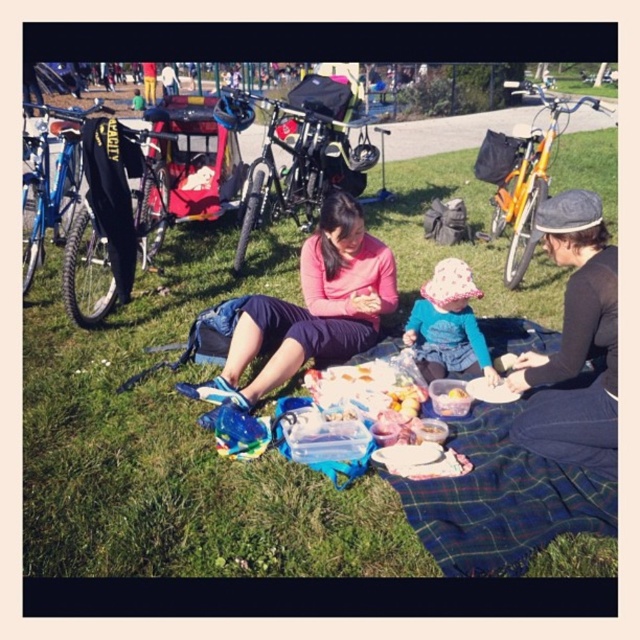
Question: Among these objects, which one is farthest from the camera?

Choices:
 (A) fluffy pink hat at center
 (B) brushed metal bicycle at center

Answer: (B)

Question: From the image, what is the correct spatial relationship of dark gray knit hat at lower right in relation to pink matte sweater at center?

Choices:
 (A) right
 (B) left

Answer: (A)

Question: Which object appears closest to the camera in this image?

Choices:
 (A) brushed metal bicycle at center
 (B) green grass at center
 (C) dark gray knit hat at lower right
 (D) smooth plastic container at center

Answer: (B)

Question: Is green grass at center to the right of smooth plastic container at center from the viewer's perspective?

Choices:
 (A) yes
 (B) no

Answer: (A)

Question: Which object appears closest to the camera in this image?

Choices:
 (A) smooth plastic container at center
 (B) fluffy pink hat at center
 (C) pink matte sweater at center

Answer: (C)

Question: Does pink matte sweater at center lie in front of orange matte bicycle at upper right?

Choices:
 (A) yes
 (B) no

Answer: (A)